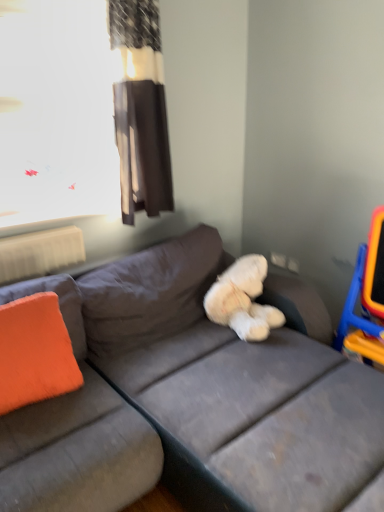
Question: Considering the positions of orange fabric pillow at left and white fluffy teddy bear at center in the image, is orange fabric pillow at left wider or thinner than white fluffy teddy bear at center?

Choices:
 (A) wide
 (B) thin

Answer: (B)

Question: Which is correct: orange fabric pillow at left is inside white fluffy teddy bear at center, or outside of it?

Choices:
 (A) outside
 (B) inside

Answer: (A)

Question: Which object is the farthest from the orange fabric pillow at left?

Choices:
 (A) brown fabric curtain at upper center
 (B) orange plastic swivel chair at right
 (C) gray fabric couch at center
 (D) transparent plastic window screen at upper left
 (E) white fluffy teddy bear at center

Answer: (B)

Question: Which object is the farthest from the brown fabric curtain at upper center?

Choices:
 (A) orange fabric pillow at left
 (B) gray fabric couch at center
 (C) white fluffy teddy bear at center
 (D) transparent plastic window screen at upper left
 (E) orange plastic swivel chair at right

Answer: (E)